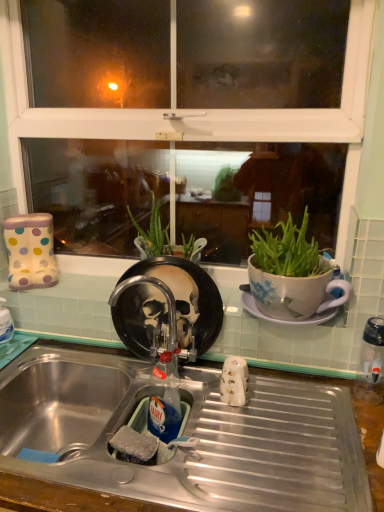
Question: Could you tell me if clear plastic water bottle at right is turned towards translucent plastic bottle at sink?

Choices:
 (A) yes
 (B) no

Answer: (B)

Question: Is translucent plastic bottle at sink at the back of clear plastic water bottle at right?

Choices:
 (A) no
 (B) yes

Answer: (A)

Question: Is clear plastic water bottle at right thinner than translucent plastic bottle at sink?

Choices:
 (A) yes
 (B) no

Answer: (B)

Question: Would you say clear plastic water bottle at right is outside translucent plastic bottle at sink?

Choices:
 (A) yes
 (B) no

Answer: (A)

Question: From the image's perspective, does clear plastic water bottle at right appear higher than translucent plastic bottle at sink?

Choices:
 (A) no
 (B) yes

Answer: (B)

Question: Does point (147, 462) appear closer or farther from the camera than point (205, 497)?

Choices:
 (A) farther
 (B) closer

Answer: (A)

Question: Choose the correct answer: Is rubber sponge at sink inside metallic stainless steel sink at lower center or outside it?

Choices:
 (A) inside
 (B) outside

Answer: (A)

Question: Looking at their shapes, would you say rubber sponge at sink is wider or thinner than metallic stainless steel sink at lower center?

Choices:
 (A) thin
 (B) wide

Answer: (A)

Question: Considering the positions of rubber sponge at sink and metallic stainless steel sink at lower center in the image, is rubber sponge at sink taller or shorter than metallic stainless steel sink at lower center?

Choices:
 (A) tall
 (B) short

Answer: (B)

Question: Is metallic faucet at center in front of or behind white ceramic saucer at right in the image?

Choices:
 (A) front
 (B) behind

Answer: (A)

Question: Is point (144, 301) positioned closer to the camera than point (322, 318)?

Choices:
 (A) farther
 (B) closer

Answer: (A)

Question: Visually, is metallic faucet at center positioned to the left or to the right of white ceramic saucer at right?

Choices:
 (A) left
 (B) right

Answer: (A)

Question: Is metallic faucet at center taller or shorter than white ceramic saucer at right?

Choices:
 (A) short
 (B) tall

Answer: (B)

Question: Is metallic stainless steel sink at lower center inside the boundaries of translucent plastic bottle at sink, or outside?

Choices:
 (A) inside
 (B) outside

Answer: (B)

Question: Relative to translucent plastic bottle at sink, is metallic stainless steel sink at lower center in front or behind?

Choices:
 (A) behind
 (B) front

Answer: (B)